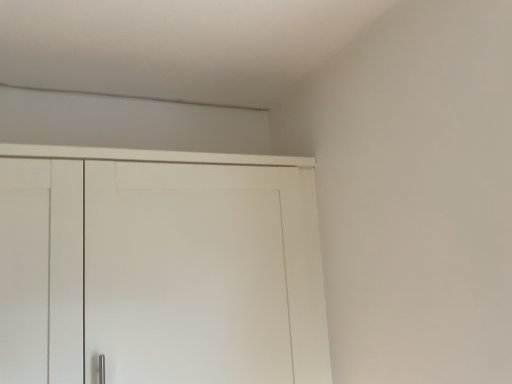
Where is `white matte cupboard at center`? The height and width of the screenshot is (384, 512). white matte cupboard at center is located at coordinates (284, 239).

Image resolution: width=512 pixels, height=384 pixels. What do you see at coordinates (284, 239) in the screenshot?
I see `white matte cupboard at center` at bounding box center [284, 239].

At what (x,y) coordinates should I click in order to perform the action: click on white matte cupboard at center. Please return your answer as a coordinate pair (x, y). Image resolution: width=512 pixels, height=384 pixels. Looking at the image, I should click on (284, 239).